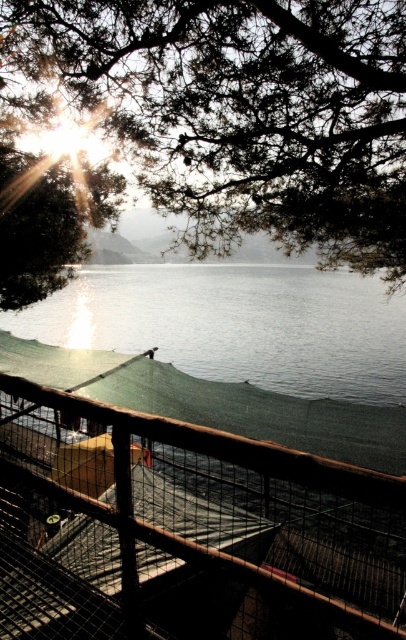
You are standing at the edge of the lakeside and want to take a photo of the brown wooden fence at lower center. According to the scene description, where exactly should you position yourself to capture the fence in your shot?

The brown wooden fence at lower center is located at point (185, 531), so you should position yourself at that coordinate to capture the fence in your shot.

Looking at this image, you are standing on a lakeside viewing platform and want to take a photo of the brown wooden fence at lower center and the green leafy tree at upper center. Which object will appear wider in the photo?

The brown wooden fence at lower center will appear wider in the photo because its width is larger than the green leafy tree at upper center.

You are standing on the lakeside platform and looking at the brown wooden fence at lower center and the green leafy tree at upper center. Which object appears larger in the scene?

Answer: The brown wooden fence at lower center appears larger than the green leafy tree at upper center in the scene.